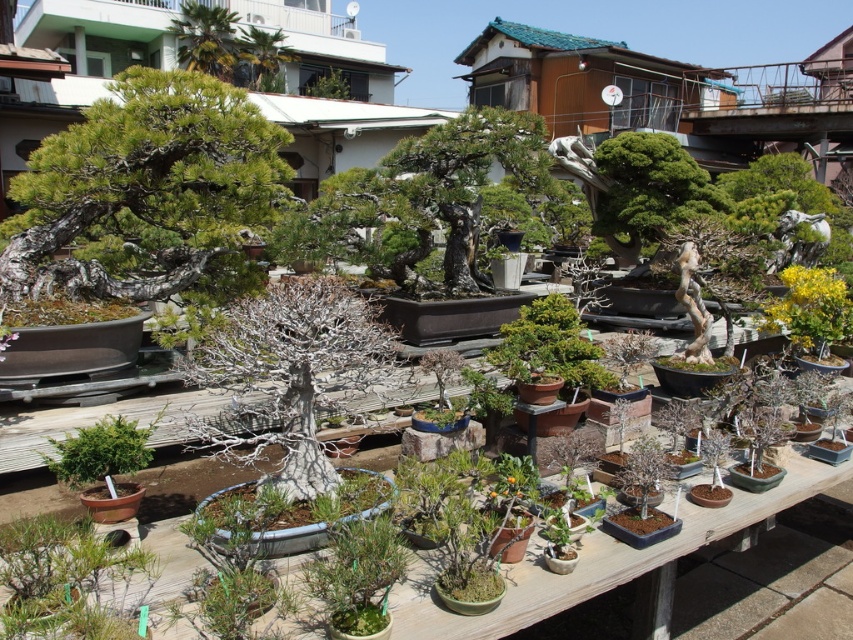
You are a gardener who wants to place a new small statue between the green matte bonsai tree at upper left and the green matte bonsai tree at center. Based on their heights, which bonsai tree should the statue be placed closer to for visual balance?

The green matte bonsai tree at upper left is much taller than the green matte bonsai tree at center, so the statue should be placed closer to the shorter green matte bonsai tree at center to create visual balance.

In the bonsai nursery scene, you see a green leafy palm at upper center and a green leafy tree at upper center. Which one is positioned to the left?

The green leafy palm at upper center is positioned to the left of the green leafy tree at upper center.